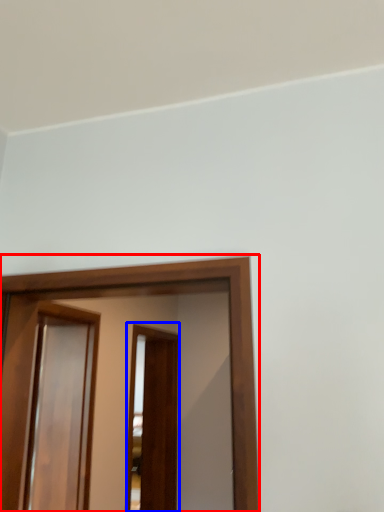
Question: Among these objects, which one is farthest to the camera, screen door (highlighted by a red box) or screen door (highlighted by a blue box)?

Choices:
 (A) screen door
 (B) screen door

Answer: (B)